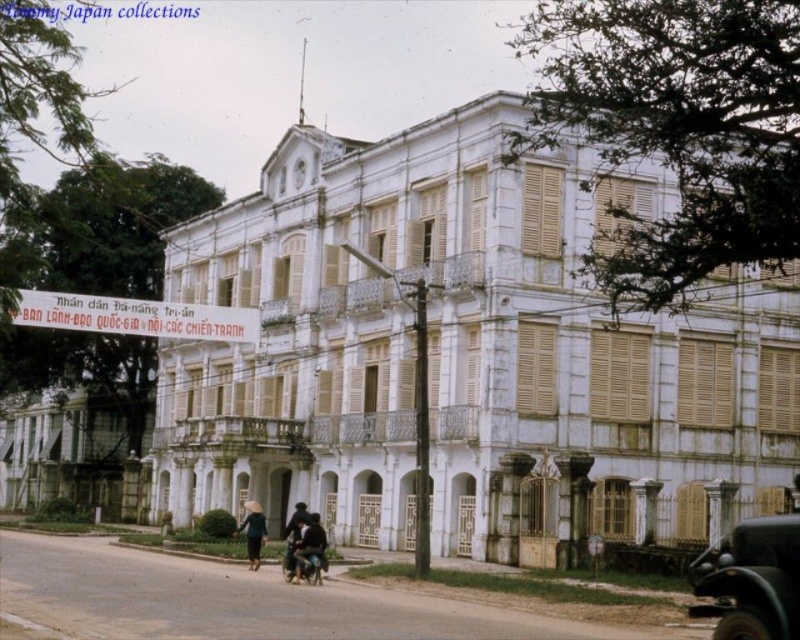
Which is behind, point (88, 468) or point (722, 552)?

The point (88, 468) is more distant.

Does white painted wood palace at lower left have a smaller size compared to shiny black car at lower right?

No.

Where is `white painted wood palace at lower left`? The height and width of the screenshot is (640, 800). white painted wood palace at lower left is located at coordinates tap(70, 454).

Can you confirm if white painted wood palace at center is taller than dark blue fabric jacket at center?

Yes.

Based on the photo, can you confirm if white painted wood palace at center is shorter than dark blue fabric jacket at center?

No, white painted wood palace at center is not shorter than dark blue fabric jacket at center.

Where is `white painted wood palace at center`? The width and height of the screenshot is (800, 640). white painted wood palace at center is located at coordinates (458, 352).

Image resolution: width=800 pixels, height=640 pixels. What are the coordinates of `white painted wood palace at center` in the screenshot? It's located at (458, 352).

Is white painted wood palace at center closer to the viewer compared to shiny black car at lower right?

No, it is not.

Between point (322, 458) and point (732, 577), which one is positioned behind?

The point (322, 458) is more distant.

Between point (513, 483) and point (786, 634), which one is positioned in front?

Point (786, 634)

Find the location of a particular element. The image size is (800, 640). white painted wood palace at center is located at coordinates click(458, 352).